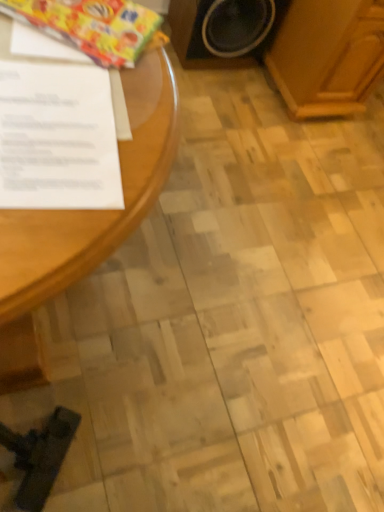
Question: From a real-world perspective, is white paper at left physically located above or below shiny plastic wrapping paper at upper left?

Choices:
 (A) above
 (B) below

Answer: (A)

Question: Relative to shiny plastic wrapping paper at upper left, is white paper at left in front or behind?

Choices:
 (A) front
 (B) behind

Answer: (A)

Question: Estimate the real-world distances between objects in this image. Which object is farther from the white paper at left?

Choices:
 (A) light brown wood at upper right
 (B) wooden speaker at upper right
 (C) shiny plastic wrapping paper at upper left

Answer: (A)

Question: Based on their relative distances, which object is nearer to the white paper at left?

Choices:
 (A) shiny plastic wrapping paper at upper left
 (B) wooden speaker at upper right
 (C) light brown wood at upper right

Answer: (A)